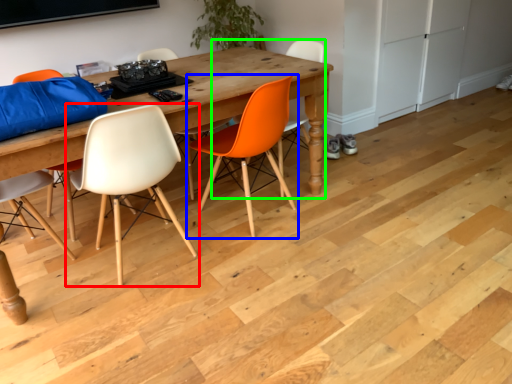
Question: Which object is positioned closest to chair (highlighted by a red box)? Select from chair (highlighted by a blue box) and chair (highlighted by a green box).

Choices:
 (A) chair
 (B) chair

Answer: (A)